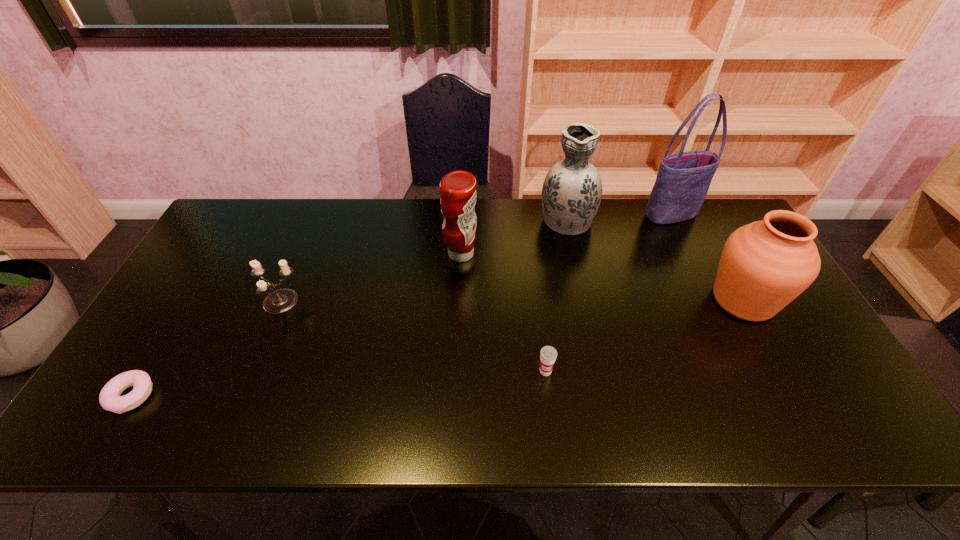
I want to click on the leftmost object, so click(109, 398).

The height and width of the screenshot is (540, 960). In order to click on the shortest object in this screenshot , I will do `click(109, 398)`.

Where is `vacant space situated 0.090m on the front of the tallest object`? This screenshot has width=960, height=540. vacant space situated 0.090m on the front of the tallest object is located at coordinates (684, 244).

You are a GUI agent. You are given a task and a screenshot of the screen. Output one action in this format:
    pyautogui.click(x=<x>, y=<y>)
    Task: Click on the vacant space situated 0.090m on the front of the urn
    The height and width of the screenshot is (540, 960).
    Given the screenshot: What is the action you would take?
    pyautogui.click(x=776, y=360)

Find the location of a particular element. vacant area situated 0.350m on the front of the fifth object from right to left is located at coordinates (456, 371).

Identify the location of blank space located 0.280m on the front of the sixth object from right to left. (233, 415).

Find the location of a particular element. vacant space located on the side of the second shortest object with the logo is located at coordinates (554, 439).

I want to click on vacant region located on the right of the leftmost object, so click(x=209, y=396).

The width and height of the screenshot is (960, 540). Find the location of `tote bag that is at the far edge`. tote bag that is at the far edge is located at coordinates (683, 180).

Where is `vase that is at the far edge`? vase that is at the far edge is located at coordinates (571, 194).